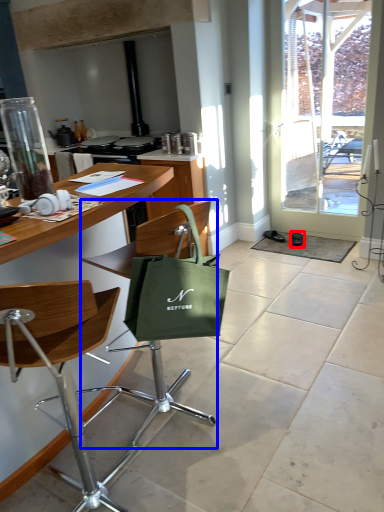
Question: Which point is closer to the camera, footwear (highlighted by a red box) or chair (highlighted by a blue box)?

Choices:
 (A) footwear
 (B) chair

Answer: (B)